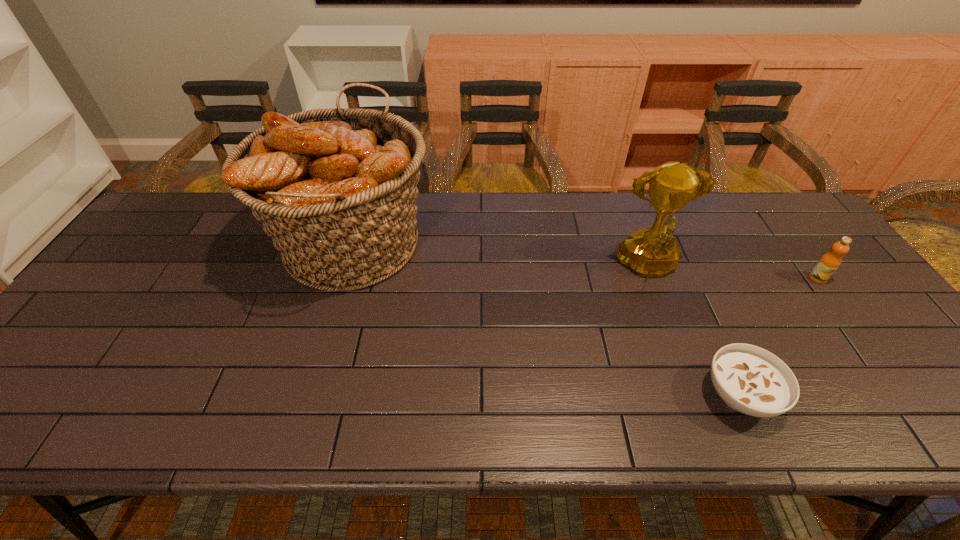
Where is `the second closest object to the rightmost object`? The width and height of the screenshot is (960, 540). the second closest object to the rightmost object is located at coordinates (751, 380).

Where is `blank space that satisfies the following two spatial constraints: 1. on the front side of the nearest object; 2. on the left side of the second tallest object`? blank space that satisfies the following two spatial constraints: 1. on the front side of the nearest object; 2. on the left side of the second tallest object is located at coordinates (696, 395).

The image size is (960, 540). I want to click on vacant area that satisfies the following two spatial constraints: 1. on the front side of the third shortest object; 2. on the left side of the shortest object, so click(696, 395).